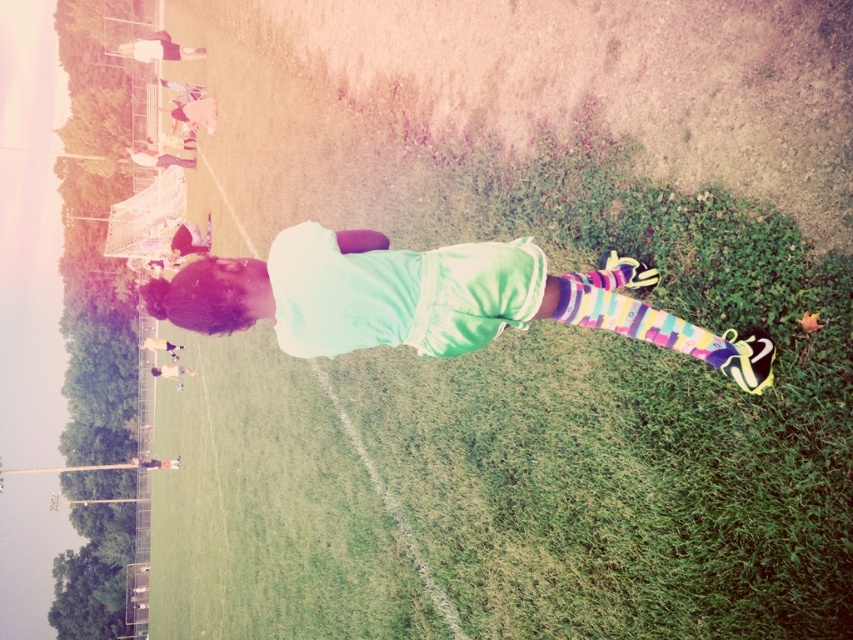
Question: Which point is closer to the camera?

Choices:
 (A) multicolored knitted sock at lower right
 (B) white matte shirt at center

Answer: (B)

Question: Can you confirm if white matte shirt at center is smaller than multicolored knitted sock at lower right?

Choices:
 (A) yes
 (B) no

Answer: (B)

Question: Is white matte shirt at center wider than multicolored knitted sock at lower right?

Choices:
 (A) yes
 (B) no

Answer: (A)

Question: Does white matte shirt at center have a lesser width compared to multicolored knitted sock at lower right?

Choices:
 (A) no
 (B) yes

Answer: (A)